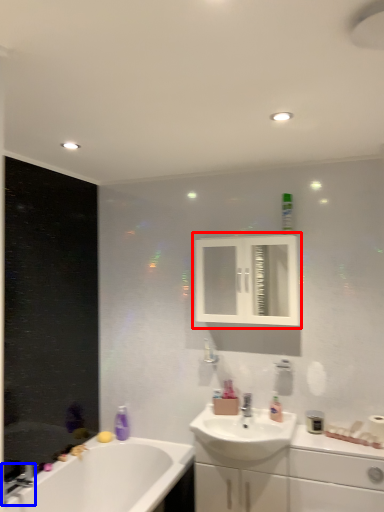
Question: Which of the following is the farthest to the observer, medicine cabinet (highlighted by a red box) or tap (highlighted by a blue box)?

Choices:
 (A) medicine cabinet
 (B) tap

Answer: (A)